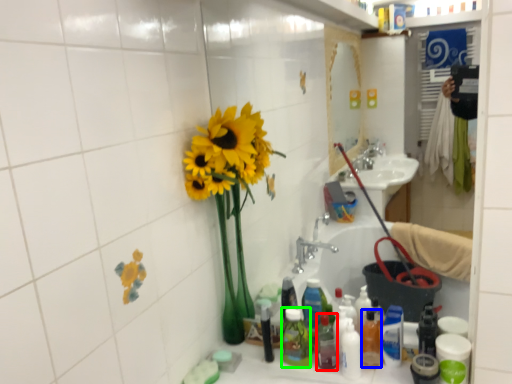
Question: Estimate the real-world distances between objects in this image. Which object is farther from bottle (highlighted by a red box), bottle (highlighted by a blue box) or toiletry (highlighted by a green box)?

Choices:
 (A) bottle
 (B) toiletry

Answer: (A)